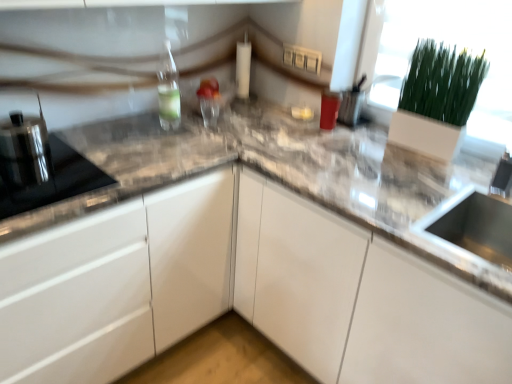
You are a GUI agent. You are given a task and a screenshot of the screen. Output one action in this format:
    pyautogui.click(x=<x>, y=<y>)
    Task: Click on the vacant point to the right of satin black kettle at left, marked as the first appliance in a left-to-right arrangement
    This screenshot has height=384, width=512.
    Given the screenshot: What is the action you would take?
    pyautogui.click(x=78, y=160)